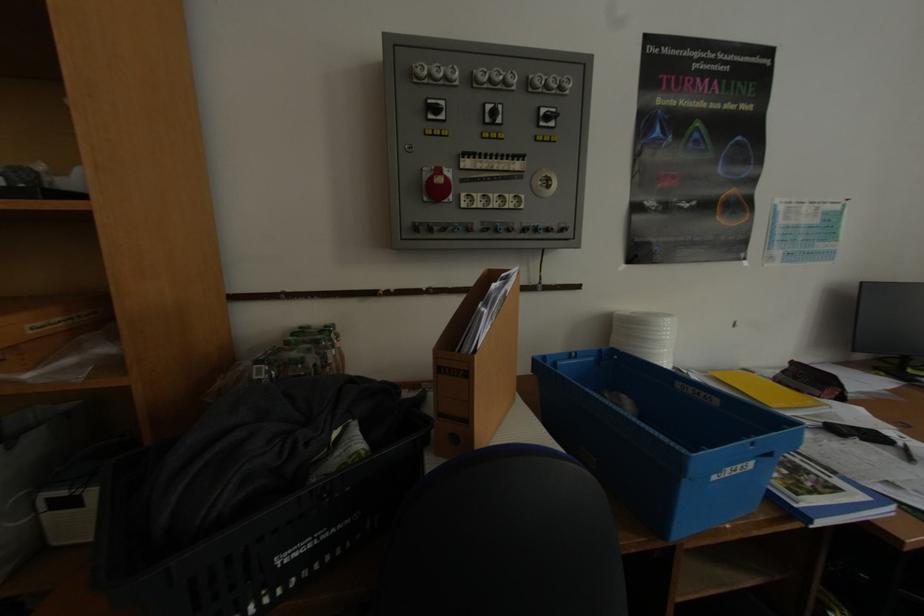
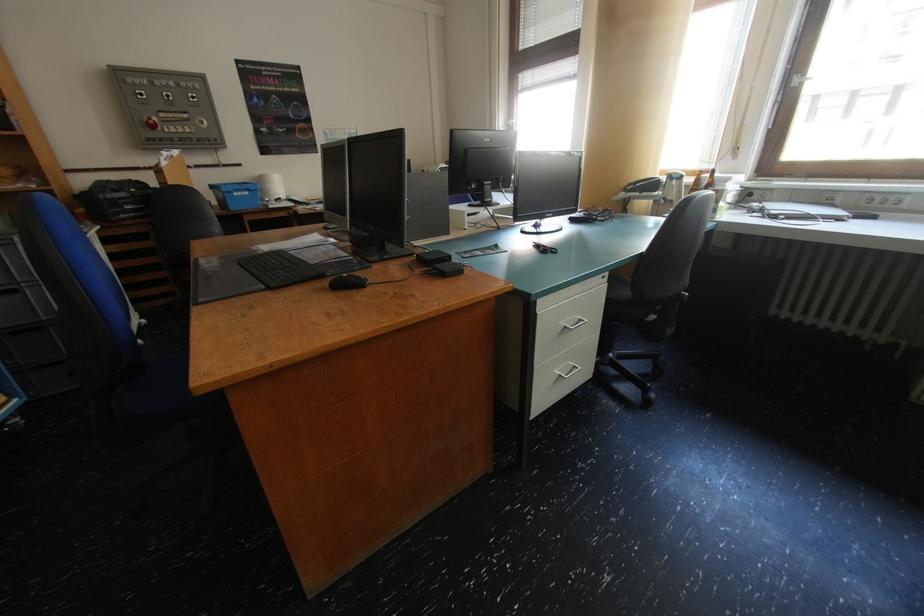
Question: The images are taken continuously from a first-person perspective. In which direction are you moving?

Choices:
 (A) Left
 (B) Right
 (C) Forward
 (D) Backward

Answer: (D)